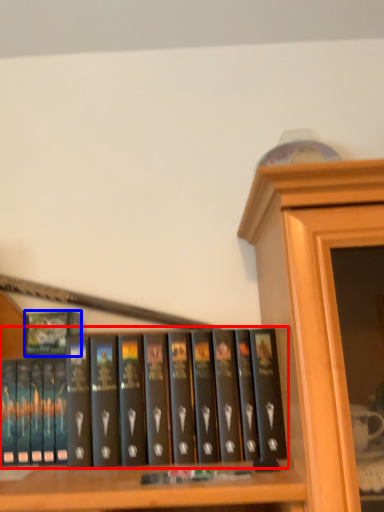
Question: Which object is closer to the camera taking this photo, book (highlighted by a red box) or book cover (highlighted by a blue box)?

Choices:
 (A) book
 (B) book cover

Answer: (A)